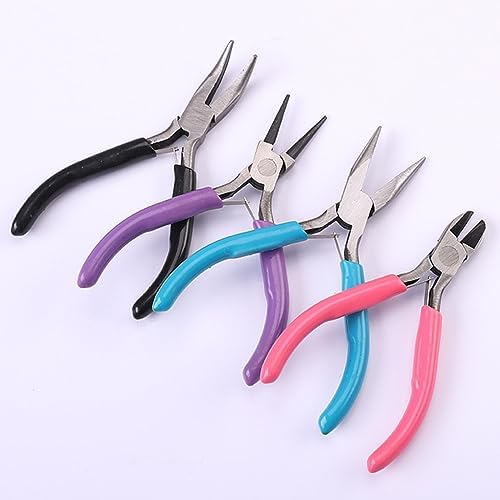
I want to click on pink handles, so click(430, 366), click(375, 302).